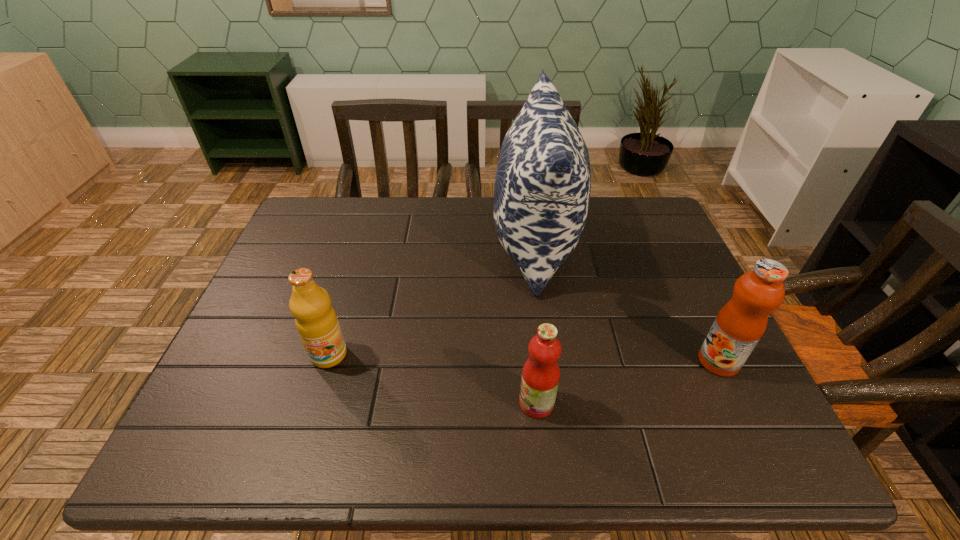
Identify the location of vacant area that lies between the farthest object and the rightmost fruit juice. Image resolution: width=960 pixels, height=540 pixels. (626, 303).

The height and width of the screenshot is (540, 960). Find the location of `free space between the farthest object and the rightmost object`. free space between the farthest object and the rightmost object is located at coordinates (626, 303).

Image resolution: width=960 pixels, height=540 pixels. I want to click on unoccupied position between the nearest fruit juice and the tallest object, so click(536, 324).

Locate an element on the screen. free spot between the rightmost object and the farthest object is located at coordinates (626, 303).

Where is `empty space between the rightmost object and the tallest object`? Image resolution: width=960 pixels, height=540 pixels. empty space between the rightmost object and the tallest object is located at coordinates pyautogui.click(x=626, y=303).

Identify which object is the closest to the rightmost fruit juice. Please provide its 2D coordinates. Your answer should be formatted as a tuple, i.e. [(x, y)], where the tuple contains the x and y coordinates of a point satisfying the conditions above.

[(542, 187)]

You are a GUI agent. You are given a task and a screenshot of the screen. Output one action in this format:
    pyautogui.click(x=<x>, y=<y>)
    Task: Click on the object that is the closest one to the second fruit juice from right to left
    The image size is (960, 540).
    Given the screenshot: What is the action you would take?
    pyautogui.click(x=542, y=187)

Identify which fruit juice is the closest to the tallest object. Please provide its 2D coordinates. Your answer should be formatted as a tuple, i.e. [(x, y)], where the tuple contains the x and y coordinates of a point satisfying the conditions above.

[(741, 322)]

You are a GUI agent. You are given a task and a screenshot of the screen. Output one action in this format:
    pyautogui.click(x=<x>, y=<y>)
    Task: Click on the fruit juice that is the second closest to the rightmost object
    
    Given the screenshot: What is the action you would take?
    pyautogui.click(x=316, y=321)

The image size is (960, 540). Identify the location of vacant space that satisfies the following two spatial constraints: 1. on the front surface of the farthest object; 2. on the front label of the leftmost fruit juice. (550, 355).